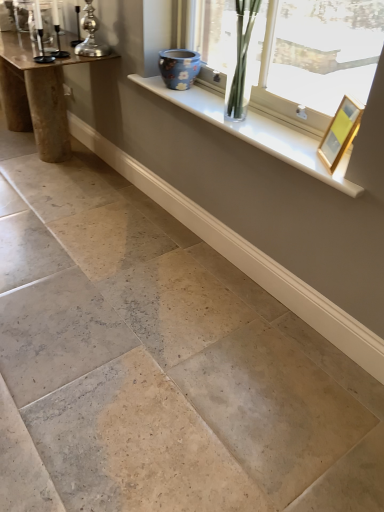
Measure the distance between point (83,21) and camera.

The depth of point (83,21) is 8.21 feet.

This screenshot has height=512, width=384. Describe the element at coordinates (41, 38) in the screenshot. I see `metallic silver candle holder at left, the 1th candle holder in the left-to-right sequence` at that location.

Describe the element at coordinates (179, 68) in the screenshot. The height and width of the screenshot is (512, 384). I see `blue floral ceramic vase at upper center` at that location.

The height and width of the screenshot is (512, 384). What do you see at coordinates (257, 130) in the screenshot?
I see `white glossy window sill at upper center` at bounding box center [257, 130].

Find the location of a particular element. The image size is (384, 512). silver metallic candle holder at upper left, arranged as the first candle holder when viewed from the right is located at coordinates (91, 35).

How much distance is there between silver metallic candle holder at upper left, arranged as the first candle holder when viewed from the right, and metallic silver candle holder at left, the 1th candle holder in the left-to-right sequence?

silver metallic candle holder at upper left, arranged as the first candle holder when viewed from the right, is 9.38 inches from metallic silver candle holder at left, the 1th candle holder in the left-to-right sequence.

Can you confirm if silver metallic candle holder at upper left, the second candle holder viewed from the left, is smaller than metallic silver candle holder at left, the second candle holder when ordered from right to left?

No.

Considering the relative positions of silver metallic candle holder at upper left, arranged as the first candle holder when viewed from the right, and metallic silver candle holder at left, the 1th candle holder in the left-to-right sequence, in the image provided, is silver metallic candle holder at upper left, arranged as the first candle holder when viewed from the right, to the left of metallic silver candle holder at left, the 1th candle holder in the left-to-right sequence, from the viewer's perspective?

Incorrect, silver metallic candle holder at upper left, arranged as the first candle holder when viewed from the right, is not on the left side of metallic silver candle holder at left, the 1th candle holder in the left-to-right sequence.

Is silver metallic candle holder at upper left, the second candle holder viewed from the left, wider than metallic silver candle holder at left, the 1th candle holder in the left-to-right sequence?

Yes.

Identify the location of vase located above the natural stone floor at center (from a real-world perspective). This screenshot has height=512, width=384. (179, 68).

Would you consider natural stone floor at center to be distant from blue floral ceramic vase at upper center?

natural stone floor at center is far away from blue floral ceramic vase at upper center.

Does point (295, 387) come farther from viewer compared to point (173, 66)?

That is False.

Is natural stone floor at center in front of or behind blue floral ceramic vase at upper center in the image?

natural stone floor at center is positioned closer to the viewer than blue floral ceramic vase at upper center.

Is metallic silver candle holder at left, the 1th candle holder in the left-to-right sequence, inside or outside of clear glass vase at upper center?

metallic silver candle holder at left, the 1th candle holder in the left-to-right sequence, is not enclosed by clear glass vase at upper center.

From the image's perspective, is metallic silver candle holder at left, the second candle holder when ordered from right to left, on clear glass vase at upper center?

Yes.

Is the surface of metallic silver candle holder at left, the 1th candle holder in the left-to-right sequence, in direct contact with clear glass vase at upper center?

No, metallic silver candle holder at left, the 1th candle holder in the left-to-right sequence, is not in contact with clear glass vase at upper center.

From a real-world perspective, who is located lower, metallic silver candle holder at left, the 1th candle holder in the left-to-right sequence, or clear glass vase at upper center?

In real-world perspective, clear glass vase at upper center is lower.

Is wooden table at left taller than silver metallic candle holder at upper left, arranged as the first candle holder when viewed from the right?

Correct, wooden table at left is much taller as silver metallic candle holder at upper left, arranged as the first candle holder when viewed from the right.

Is wooden table at left not close to silver metallic candle holder at upper left, arranged as the first candle holder when viewed from the right?

wooden table at left is actually quite close to silver metallic candle holder at upper left, arranged as the first candle holder when viewed from the right.

From a real-world perspective, is wooden table at left beneath silver metallic candle holder at upper left, arranged as the first candle holder when viewed from the right?

Correct, in the physical world, wooden table at left is lower than silver metallic candle holder at upper left, arranged as the first candle holder when viewed from the right.

Would you say white glossy window sill at upper center contains metallic silver candle holder at left, the second candle holder when ordered from right to left?

No, metallic silver candle holder at left, the second candle holder when ordered from right to left, is not a part of white glossy window sill at upper center.

How many degrees apart are the facing directions of white glossy window sill at upper center and metallic silver candle holder at left, the 1th candle holder in the left-to-right sequence?

The facing directions of white glossy window sill at upper center and metallic silver candle holder at left, the 1th candle holder in the left-to-right sequence, are 0.544 degrees apart.

Which of these two, white glossy window sill at upper center or metallic silver candle holder at left, the 1th candle holder in the left-to-right sequence, is thinner?

metallic silver candle holder at left, the 1th candle holder in the left-to-right sequence, is thinner.

Is metallic silver candle holder at left, the second candle holder when ordered from right to left, situated inside natural stone floor at center or outside?

metallic silver candle holder at left, the second candle holder when ordered from right to left, is outside natural stone floor at center.

Does metallic silver candle holder at left, the second candle holder when ordered from right to left, appear on the right side of natural stone floor at center?

Indeed, metallic silver candle holder at left, the second candle holder when ordered from right to left, is positioned on the right side of natural stone floor at center.

Are metallic silver candle holder at left, the 1th candle holder in the left-to-right sequence, and natural stone floor at center located far from each other?

metallic silver candle holder at left, the 1th candle holder in the left-to-right sequence, is positioned a significant distance from natural stone floor at center.

From a real-world perspective, which is physically above, metallic silver candle holder at left, the second candle holder when ordered from right to left, or natural stone floor at center?

From a 3D spatial view, metallic silver candle holder at left, the second candle holder when ordered from right to left, is above.

Which of these two, clear glass vase at upper center or gold metallic picture frame at upper right, is thinner?

Thinner between the two is gold metallic picture frame at upper right.

Find the location of a particular element. Image resolution: width=384 pixels, height=512 pixels. picture frame that is below the clear glass vase at upper center (from the image's perspective) is located at coordinates (340, 133).

From the picture: Which of these two, clear glass vase at upper center or gold metallic picture frame at upper right, stands shorter?

gold metallic picture frame at upper right is shorter.

This screenshot has height=512, width=384. Identify the location of candle holder below the metallic silver candle holder at left, the second candle holder when ordered from right to left (from a real-world perspective). click(x=91, y=35).

You are a GUI agent. You are given a task and a screenshot of the screen. Output one action in this format:
    pyautogui.click(x=<x>, y=<y>)
    Task: Click on the vase behind the natural stone floor at center
    Image resolution: width=384 pixels, height=512 pixels.
    Given the screenshot: What is the action you would take?
    pyautogui.click(x=179, y=68)

Looking at the image, which one is located closer to clear glass vase at upper center, wooden table at left or natural stone floor at center?

Among the two, natural stone floor at center is located nearer to clear glass vase at upper center.

Looking at the image, which one is located closer to wooden table at left, gold metallic picture frame at upper right or metallic silver candle holder at left, the second candle holder when ordered from right to left?

metallic silver candle holder at left, the second candle holder when ordered from right to left, is closer to wooden table at left.

Based on their spatial positions, is clear glass vase at upper center or blue floral ceramic vase at upper center further from natural stone floor at center?

blue floral ceramic vase at upper center lies further to natural stone floor at center than the other object.

Estimate the real-world distances between objects in this image. Which object is further from blue floral ceramic vase at upper center, metallic silver candle holder at left, the 1th candle holder in the left-to-right sequence, or clear glass vase at upper center?

metallic silver candle holder at left, the 1th candle holder in the left-to-right sequence.

Based on the photo, based on their spatial positions, is gold metallic picture frame at upper right or clear glass vase at upper center closer to white glossy window sill at upper center?

clear glass vase at upper center is positioned closer to the anchor white glossy window sill at upper center.

Based on the photo, which object lies nearer to the anchor point metallic silver candle holder at left, the second candle holder when ordered from right to left, clear glass vase at upper center or gold metallic picture frame at upper right?

clear glass vase at upper center lies closer to metallic silver candle holder at left, the second candle holder when ordered from right to left, than the other object.

Considering their positions, is clear glass vase at upper center positioned further to silver metallic candle holder at upper left, arranged as the first candle holder when viewed from the right, than natural stone floor at center?

Based on the image, natural stone floor at center appears to be further to silver metallic candle holder at upper left, arranged as the first candle holder when viewed from the right.

Looking at the image, which one is located closer to wooden table at left, blue floral ceramic vase at upper center or metallic silver candle holder at left, the 1th candle holder in the left-to-right sequence?

metallic silver candle holder at left, the 1th candle holder in the left-to-right sequence.

Image resolution: width=384 pixels, height=512 pixels. Find the location of `window between natural stone floor at center and white glossy window sill at upper center in the horizontal direction`. window between natural stone floor at center and white glossy window sill at upper center in the horizontal direction is located at coordinates (317, 59).

Locate an element on the screen. window between wooden table at left and gold metallic picture frame at upper right in the horizontal direction is located at coordinates (317, 59).

Where is `candle holder situated between wooden table at left and silver metallic candle holder at upper left, the second candle holder viewed from the left, from left to right`? This screenshot has height=512, width=384. candle holder situated between wooden table at left and silver metallic candle holder at upper left, the second candle holder viewed from the left, from left to right is located at coordinates (41, 38).

Find the location of `candle holder situated between metallic silver candle holder at left, the second candle holder when ordered from right to left, and gold metallic picture frame at upper right from left to right`. candle holder situated between metallic silver candle holder at left, the second candle holder when ordered from right to left, and gold metallic picture frame at upper right from left to right is located at coordinates pos(91,35).